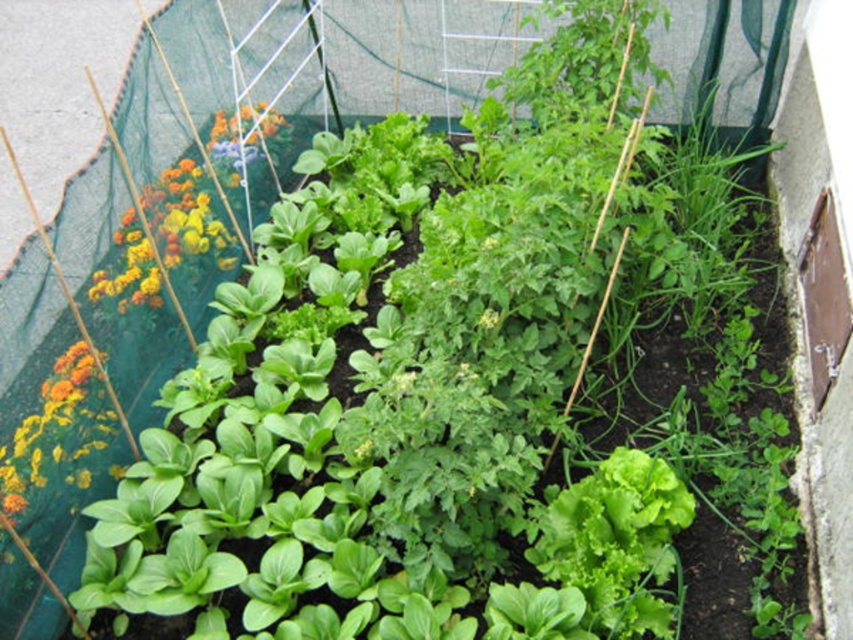
Question: Does green leafy lettuce at center lie in front of vibrant multicolored flowers at left?

Choices:
 (A) no
 (B) yes

Answer: (B)

Question: Among these points, which one is nearest to the camera?

Choices:
 (A) (537, 561)
 (B) (183, 216)

Answer: (A)

Question: Is green leafy lettuce at center to the right of vibrant multicolored flowers at left from the viewer's perspective?

Choices:
 (A) no
 (B) yes

Answer: (B)

Question: Which point is closer to the camera?

Choices:
 (A) click(218, 152)
 (B) click(635, 568)

Answer: (B)

Question: Does green leafy lettuce at center appear on the left side of vibrant multicolored flowers at left?

Choices:
 (A) no
 (B) yes

Answer: (A)